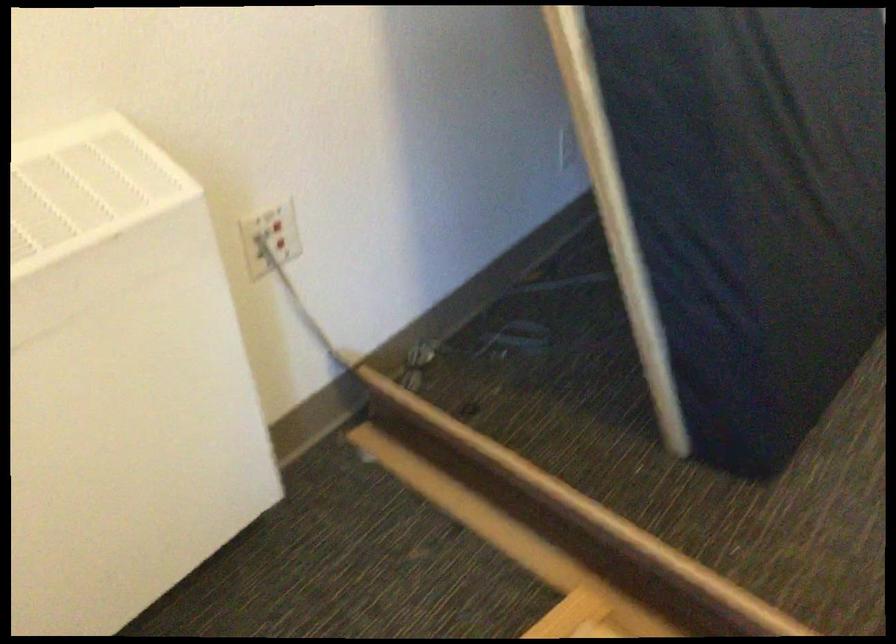
Question: The camera is either moving clockwise (left) or counter-clockwise (right) around the object. The first image is from the beginning of the video and the second image is from the end. Is the camera moving left or right when shooting the video?

Choices:
 (A) Left
 (B) Right

Answer: (A)